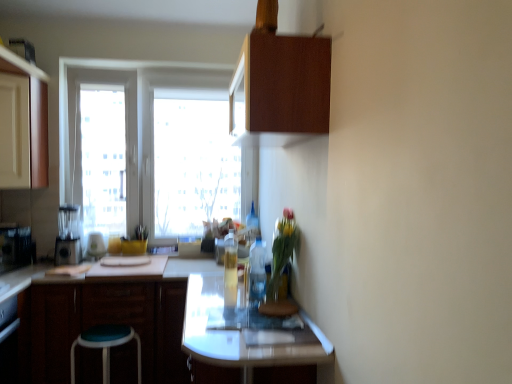
Question: Is translucent glass bottle at center, which is the first bottle in front-to-back order, taller or shorter than brushed metal blender at left, the 1th appliance from the right?

Choices:
 (A) tall
 (B) short

Answer: (A)

Question: Considering the relative positions of translucent glass bottle at center, the 3th bottle positioned from the back, and brushed metal blender at left, the 1th appliance from the right, in the image provided, is translucent glass bottle at center, the 3th bottle positioned from the back, to the left or to the right of brushed metal blender at left, the 1th appliance from the right,?

Choices:
 (A) left
 (B) right

Answer: (B)

Question: Considering the real-world distances, which object is farthest from the matte black blender at left, which is the second appliance from left to right?

Choices:
 (A) translucent glass vase at center
 (B) translucent glass bottle at center, the 3th bottle positioned from the back
 (C) metallic silver toaster at left, positioned as the 1th appliance in left-to-right order
 (D) translucent glass bottle at upper center, arranged as the 1th bottle when viewed from the back
 (E) matte wood cabinet at left, arranged as the first cabinetry when viewed from the left

Answer: (A)

Question: Which object is the farthest from the wooden cabinet at upper center, which is the third cabinetry from bottom to top?

Choices:
 (A) teal fabric stool at lower left
 (B) translucent glass bottle at upper center, arranged as the 1th bottle when viewed from the back
 (C) brushed metal blender at left, the 1th appliance from the right
 (D) metallic silver toaster at left, which appears as the 3th appliance when viewed from the right
 (E) matte black blender at left, which is counted as the 2th appliance, starting from the right

Answer: (D)